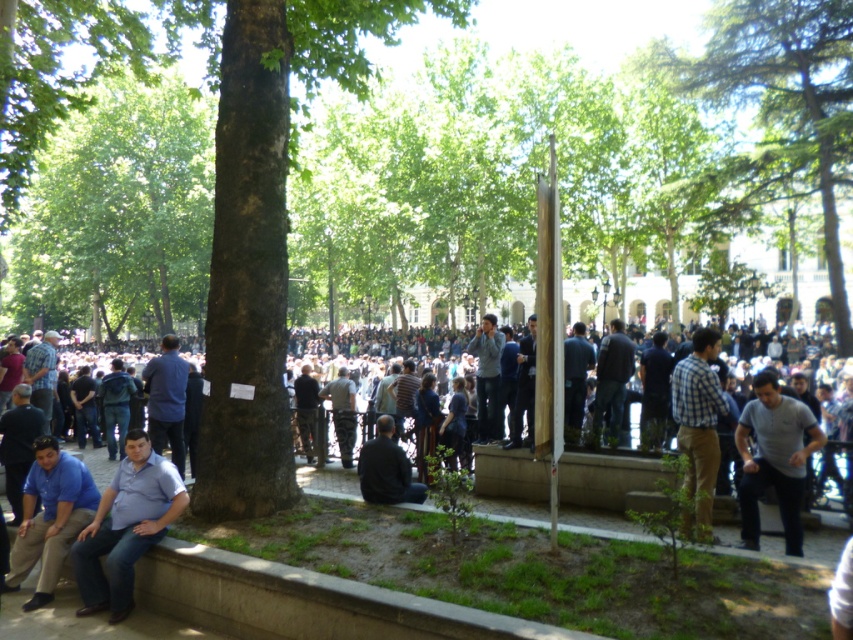
Question: Which is farther from the green leafy tree at center?

Choices:
 (A) blue shirt at center
 (B) blue cotton shirt at lower left
 (C) blue denim jeans at lower left
 (D) green textured tree at upper right

Answer: (A)

Question: Can you confirm if green leafy tree at center is positioned above blue denim jeans at lower left?

Choices:
 (A) no
 (B) yes

Answer: (B)

Question: Can you confirm if blue shirt at center is positioned below dark gray fabric jacket at center?

Choices:
 (A) no
 (B) yes

Answer: (A)

Question: Based on their relative distances, which object is farther from the gray cotton shirt at lower right?

Choices:
 (A) blue shirt at center
 (B) light blue shirt at center

Answer: (A)

Question: Is blue cotton shirt at lower left further to the viewer compared to dark gray fabric jacket at center?

Choices:
 (A) yes
 (B) no

Answer: (B)

Question: Which is nearer to the checkered fabric shirt at center?

Choices:
 (A) gray cotton shirt at lower right
 (B) green leafy tree at center
 (C) camouflage pants at center
 (D) dark gray fabric jacket at center

Answer: (A)